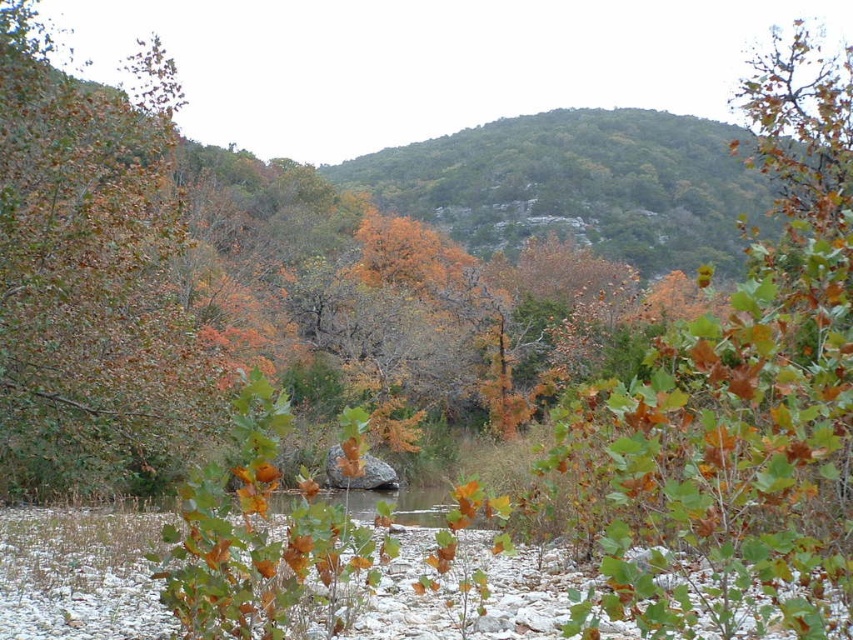
You are standing in the autumn landscape and want to walk from the green leafy tree at left to the green matte tree at center. Which direction should you head?

You should head to the right to reach the green matte tree at center from the green leafy tree at left since the green matte tree at center is to the right of the green leafy tree at left.

Looking at this image, you are an environmental scientist studying the layers of vegetation in this autumn landscape. From your current position, which tree, the green matte tree at center or the green leafy tree at left, is closer to you?

The green matte tree at center is closer to you because it is positioned in front of the green leafy tree at left.

You are an artist planning to paint the autumn landscape. You want to ensure the green matte tree at center and the green leafy tree at left are proportionally accurate. Which tree should you paint larger?

The green matte tree at center should be painted larger because it is bigger than the green leafy tree at left according to the description.